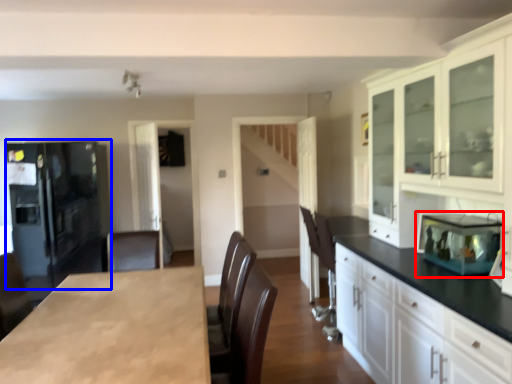
Question: Among these objects, which one is nearest to the camera, appliance (highlighted by a red box) or refrigerator (highlighted by a blue box)?

Choices:
 (A) appliance
 (B) refrigerator

Answer: (A)